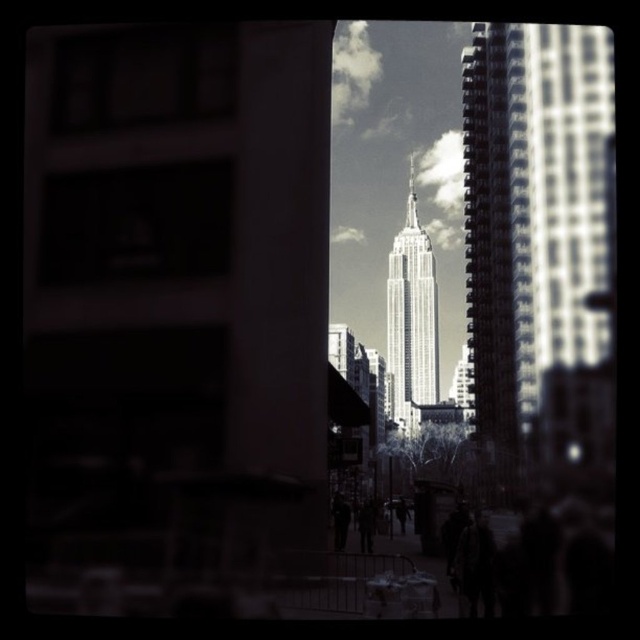
Looking at this image, you are a photographer standing in the street and want to take a picture of the smooth glass skyscraper at center and the dark fabric coat at center. Which object should you focus on to ensure both are in sharp focus?

To ensure both the smooth glass skyscraper at center and the dark fabric coat at center are in sharp focus, you should focus on the dark fabric coat at center since it is closer to you than the skyscraper.

You are a photographer standing in the city and see the smooth glass skyscraper at center and the dark fabric coat at center. Which object is wider?

The smooth glass skyscraper at center is wider than the dark fabric coat at center.

You are standing on the street and see two points marked in the scene. The first point is at coordinates point (563, 323) and the second is at point (337, 528). Which point is closer to you?

The point at (563, 323) is closer to you because it is further to the viewer than the point at (337, 528).